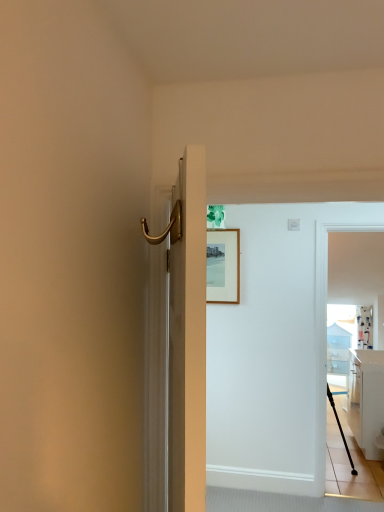
Question: Is white glossy cabinet at right not inside wooden picture frame at upper center?

Choices:
 (A) no
 (B) yes

Answer: (B)

Question: From a real-world perspective, is white glossy cabinet at right below wooden picture frame at upper center?

Choices:
 (A) no
 (B) yes

Answer: (B)

Question: Is white glossy cabinet at right facing away from wooden picture frame at upper center?

Choices:
 (A) yes
 (B) no

Answer: (B)

Question: Considering the relative sizes of white glossy cabinet at right and wooden picture frame at upper center in the image provided, is white glossy cabinet at right smaller than wooden picture frame at upper center?

Choices:
 (A) yes
 (B) no

Answer: (B)

Question: Is white glossy cabinet at right thinner than wooden picture frame at upper center?

Choices:
 (A) yes
 (B) no

Answer: (B)

Question: Is white glossy cabinet at right far away from wooden picture frame at upper center?

Choices:
 (A) no
 (B) yes

Answer: (B)

Question: Is the surface of white glossy countertop at right in direct contact with wooden picture frame at upper center?

Choices:
 (A) no
 (B) yes

Answer: (A)

Question: Can you confirm if white glossy countertop at right is wider than wooden picture frame at upper center?

Choices:
 (A) yes
 (B) no

Answer: (A)

Question: Considering the relative sizes of white glossy countertop at right and wooden picture frame at upper center in the image provided, is white glossy countertop at right thinner than wooden picture frame at upper center?

Choices:
 (A) yes
 (B) no

Answer: (B)

Question: Considering the relative sizes of white glossy countertop at right and wooden picture frame at upper center in the image provided, is white glossy countertop at right shorter than wooden picture frame at upper center?

Choices:
 (A) yes
 (B) no

Answer: (A)

Question: From a real-world perspective, is white glossy countertop at right positioned under wooden picture frame at upper center based on gravity?

Choices:
 (A) yes
 (B) no

Answer: (A)

Question: Are white glossy countertop at right and wooden picture frame at upper center far apart?

Choices:
 (A) no
 (B) yes

Answer: (B)

Question: Is white fabric curtain at upper right completely or partially inside white glossy cabinet at right?

Choices:
 (A) yes
 (B) no

Answer: (B)